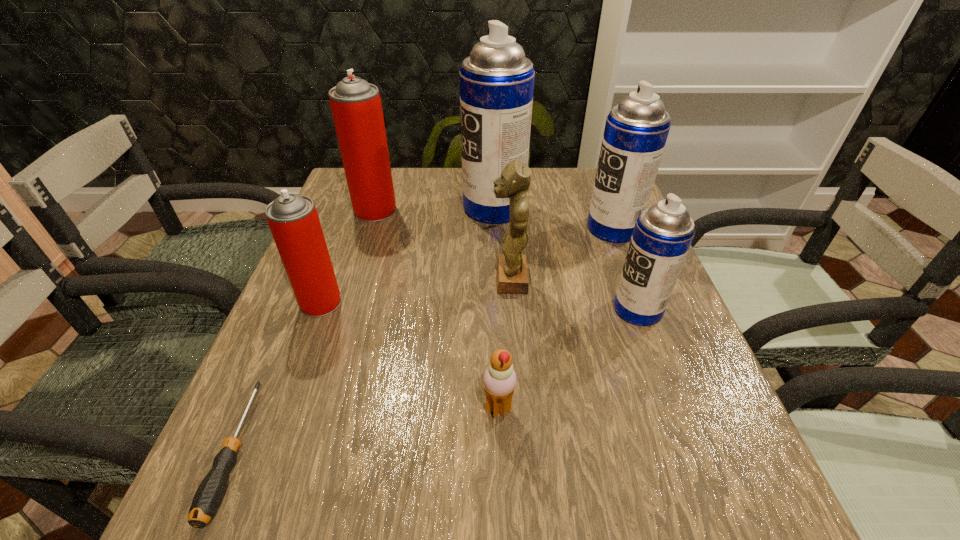
Identify the location of free spot that satisfies the following two spatial constraints: 1. on the label side of the second smallest blue aerosol can; 2. on the front side of the screwdriver. This screenshot has width=960, height=540. (698, 451).